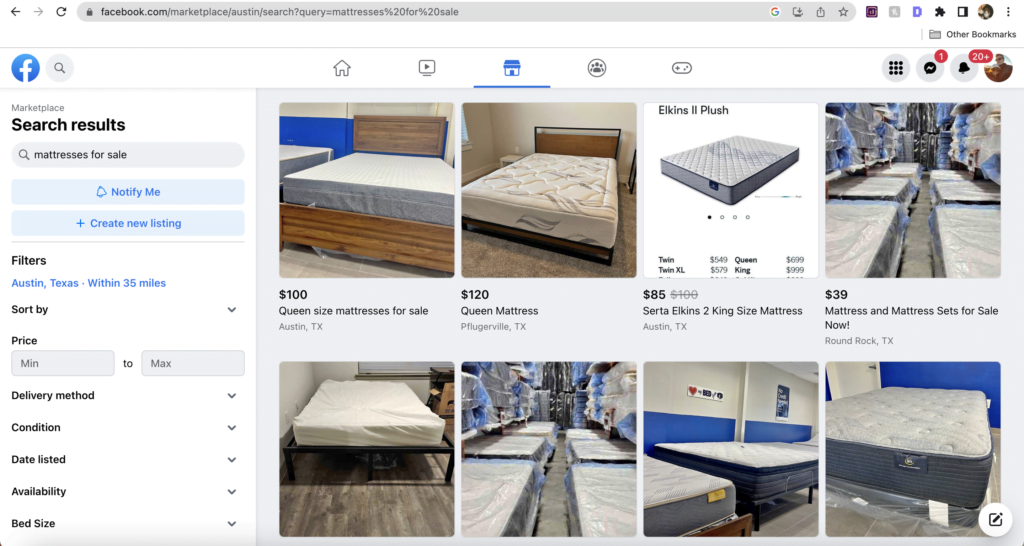
What are the coordinates of `floors` in the screenshot? It's located at (315, 268), (492, 250), (914, 253), (851, 521), (782, 522), (547, 508), (378, 497).